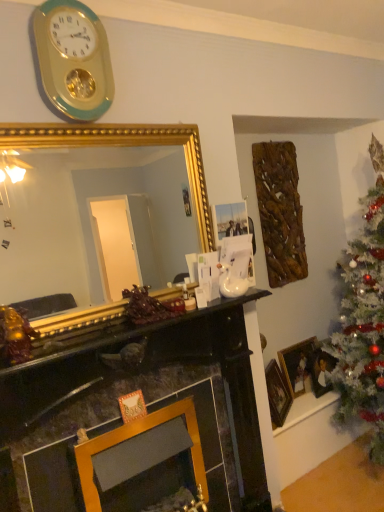
Where is `wooden picture frame at right, marked as the third picture frame in a front-to-back arrangement`? Image resolution: width=384 pixels, height=512 pixels. wooden picture frame at right, marked as the third picture frame in a front-to-back arrangement is located at coordinates (297, 365).

Describe the element at coordinates (297, 365) in the screenshot. Image resolution: width=384 pixels, height=512 pixels. I see `wooden picture frame at right, marked as the third picture frame in a front-to-back arrangement` at that location.

The height and width of the screenshot is (512, 384). What do you see at coordinates (90, 220) in the screenshot?
I see `gold/gilded mirror at center` at bounding box center [90, 220].

What do you see at coordinates (277, 394) in the screenshot?
I see `gold-framed picture at right, which appears as the 3th picture frame when viewed from the back` at bounding box center [277, 394].

The image size is (384, 512). What do you see at coordinates (363, 319) in the screenshot?
I see `white matte christmas tree at right` at bounding box center [363, 319].

Where is `wooden picture frame at lower right, which ranks as the 2th picture frame in back-to-front order`? The image size is (384, 512). wooden picture frame at lower right, which ranks as the 2th picture frame in back-to-front order is located at coordinates (320, 370).

Considering the sizes of objects gold-framed picture at right, the first picture frame from the front, and gold/gilded mirror at center in the image provided, who is smaller, gold-framed picture at right, the first picture frame from the front, or gold/gilded mirror at center?

gold-framed picture at right, the first picture frame from the front, is smaller.

From a real-world perspective, does gold-framed picture at right, which appears as the 3th picture frame when viewed from the back, sit lower than gold/gilded mirror at center?

Yes.

Could you tell me if gold-framed picture at right, which appears as the 3th picture frame when viewed from the back, is facing gold/gilded mirror at center?

No, gold-framed picture at right, which appears as the 3th picture frame when viewed from the back, is not turned towards gold/gilded mirror at center.

Considering the sizes of gold-framed picture at right, which appears as the 3th picture frame when viewed from the back, and gold/gilded mirror at center in the image, is gold-framed picture at right, which appears as the 3th picture frame when viewed from the back, taller or shorter than gold/gilded mirror at center?

Clearly, gold-framed picture at right, which appears as the 3th picture frame when viewed from the back, is shorter compared to gold/gilded mirror at center.

Is gold/green plastic wall clock at upper left facing towards wooden picture frame at right, marked as the third picture frame in a front-to-back arrangement?

No, gold/green plastic wall clock at upper left is not facing towards wooden picture frame at right, marked as the third picture frame in a front-to-back arrangement.

From the image's perspective, is gold/green plastic wall clock at upper left over wooden picture frame at right, the first picture frame viewed from the back?

Indeed, from the image's perspective, gold/green plastic wall clock at upper left is shown above wooden picture frame at right, the first picture frame viewed from the back.

Is gold/green plastic wall clock at upper left shorter than wooden picture frame at right, the first picture frame viewed from the back?

No.

Does point (106, 36) come farther from viewer compared to point (284, 364)?

That is False.

Is gold/gilded mirror at center in front of or behind wooden picture frame at lower right, which ranks as the 2th picture frame in back-to-front order, in the image?

Visually, gold/gilded mirror at center is located in front of wooden picture frame at lower right, which ranks as the 2th picture frame in back-to-front order.

In terms of height, does gold/gilded mirror at center look taller or shorter compared to wooden picture frame at lower right, which appears as the second picture frame when viewed from the front?

Clearly, gold/gilded mirror at center is taller compared to wooden picture frame at lower right, which appears as the second picture frame when viewed from the front.

Based on the photo, from the image's perspective, who appears lower, gold/gilded mirror at center or wooden picture frame at lower right, which ranks as the 2th picture frame in back-to-front order?

wooden picture frame at lower right, which ranks as the 2th picture frame in back-to-front order, is shown below in the image.

Can you confirm if gold/gilded mirror at center is thinner than wooden picture frame at lower right, which ranks as the 2th picture frame in back-to-front order?

Incorrect, the width of gold/gilded mirror at center is not less than that of wooden picture frame at lower right, which ranks as the 2th picture frame in back-to-front order.

Is wooden picture frame at lower right, which ranks as the 2th picture frame in back-to-front order, completely or partially inside wooden picture frame at right, marked as the third picture frame in a front-to-back arrangement?

That's incorrect, wooden picture frame at lower right, which ranks as the 2th picture frame in back-to-front order, is not inside wooden picture frame at right, marked as the third picture frame in a front-to-back arrangement.

Is wooden picture frame at right, marked as the third picture frame in a front-to-back arrangement, closer to camera compared to wooden picture frame at lower right, which appears as the second picture frame when viewed from the front?

No.

How different are the orientations of wooden picture frame at right, the first picture frame viewed from the back, and wooden picture frame at lower right, which ranks as the 2th picture frame in back-to-front order, in degrees?

The facing directions of wooden picture frame at right, the first picture frame viewed from the back, and wooden picture frame at lower right, which ranks as the 2th picture frame in back-to-front order, are 0.045 degrees apart.

Visually, is wooden picture frame at right, the first picture frame viewed from the back, positioned to the left or to the right of wooden picture frame at lower right, which appears as the second picture frame when viewed from the front?

Based on their positions, wooden picture frame at right, the first picture frame viewed from the back, is located to the left of wooden picture frame at lower right, which appears as the second picture frame when viewed from the front.

How many degrees apart are the facing directions of wooden picture frame at right, the first picture frame viewed from the back, and white matte christmas tree at right?

There is a 89.4-degree angle between the facing directions of wooden picture frame at right, the first picture frame viewed from the back, and white matte christmas tree at right.

Can you confirm if wooden picture frame at right, the first picture frame viewed from the back, is smaller than white matte christmas tree at right?

Indeed, wooden picture frame at right, the first picture frame viewed from the back, has a smaller size compared to white matte christmas tree at right.

From a real-world perspective, is wooden picture frame at right, marked as the third picture frame in a front-to-back arrangement, above or below white matte christmas tree at right?

From a real-world perspective, wooden picture frame at right, marked as the third picture frame in a front-to-back arrangement, is physically below white matte christmas tree at right.

Is wooden picture frame at right, marked as the third picture frame in a front-to-back arrangement, beside white matte christmas tree at right?

No, wooden picture frame at right, marked as the third picture frame in a front-to-back arrangement, is not with white matte christmas tree at right.

What's the angular difference between gold/gilded mirror at center and gold/green plastic wall clock at upper left's facing directions?

The facing directions of gold/gilded mirror at center and gold/green plastic wall clock at upper left are 0.00591 degrees apart.

From the picture: Is gold/gilded mirror at center thinner than gold/green plastic wall clock at upper left?

Yes.

Can you confirm if gold/gilded mirror at center is bigger than gold/green plastic wall clock at upper left?

Yes.

Is gold/gilded mirror at center closer to camera compared to gold/green plastic wall clock at upper left?

Yes.

Consider the image. Does gold/gilded mirror at center touch white matte christmas tree at right?

No.

You are a GUI agent. You are given a task and a screenshot of the screen. Output one action in this format:
    pyautogui.click(x=<x>, y=<y>)
    Task: Click on the mirror positioned vertically above the white matte christmas tree at right (from a real-world perspective)
    The width and height of the screenshot is (384, 512).
    Given the screenshot: What is the action you would take?
    pyautogui.click(x=90, y=220)

Considering the sizes of objects gold/gilded mirror at center and white matte christmas tree at right in the image provided, who is wider, gold/gilded mirror at center or white matte christmas tree at right?

white matte christmas tree at right.

Identify the location of mirror above the gold-framed picture at right, which appears as the 3th picture frame when viewed from the back (from the image's perspective). This screenshot has width=384, height=512. (90, 220).

From the image's perspective, count 2nd picture frames downward from the gold/green plastic wall clock at upper left and point to it. Please provide its 2D coordinates.

[(297, 365)]

From the image, which object appears to be nearer to gold/gilded mirror at center, white matte christmas tree at right or gold-framed picture at right, the first picture frame from the front?

Based on the image, white matte christmas tree at right appears to be nearer to gold/gilded mirror at center.

Looking at the image, which one is located closer to wooden picture frame at right, the first picture frame viewed from the back, white matte christmas tree at right or gold-framed picture at right, which appears as the 3th picture frame when viewed from the back?

Based on the image, gold-framed picture at right, which appears as the 3th picture frame when viewed from the back, appears to be nearer to wooden picture frame at right, the first picture frame viewed from the back.

Looking at the image, which one is located closer to wooden picture frame at right, marked as the third picture frame in a front-to-back arrangement, wooden picture frame at lower right, which ranks as the 2th picture frame in back-to-front order, or gold/gilded mirror at center?

wooden picture frame at lower right, which ranks as the 2th picture frame in back-to-front order, is closer to wooden picture frame at right, marked as the third picture frame in a front-to-back arrangement.

Looking at the image, which one is located further to wooden picture frame at lower right, which ranks as the 2th picture frame in back-to-front order, wooden picture frame at right, the first picture frame viewed from the back, or gold/green plastic wall clock at upper left?

gold/green plastic wall clock at upper left is positioned further to the anchor wooden picture frame at lower right, which ranks as the 2th picture frame in back-to-front order.

Which object lies nearer to the anchor point wooden picture frame at lower right, which appears as the second picture frame when viewed from the front, white matte christmas tree at right or gold/gilded mirror at center?

white matte christmas tree at right.

From the image, which object appears to be farther from gold-framed picture at right, which appears as the 3th picture frame when viewed from the back, white matte christmas tree at right or wooden picture frame at right, marked as the third picture frame in a front-to-back arrangement?

white matte christmas tree at right lies further to gold-framed picture at right, which appears as the 3th picture frame when viewed from the back, than the other object.

Which object lies further to the anchor point wooden picture frame at lower right, which ranks as the 2th picture frame in back-to-front order, wooden picture frame at right, marked as the third picture frame in a front-to-back arrangement, or white matte christmas tree at right?

white matte christmas tree at right.

Estimate the real-world distances between objects in this image. Which object is further from wooden picture frame at lower right, which appears as the second picture frame when viewed from the front, gold/gilded mirror at center or gold-framed picture at right, the first picture frame from the front?

gold/gilded mirror at center is further to wooden picture frame at lower right, which appears as the second picture frame when viewed from the front.

The width and height of the screenshot is (384, 512). I want to click on picture frame located between white matte christmas tree at right and wooden picture frame at lower right, which appears as the second picture frame when viewed from the front, in the depth direction, so [277, 394].

Identify the location of mirror between gold/green plastic wall clock at upper left and white matte christmas tree at right in the horizontal direction. The height and width of the screenshot is (512, 384). (90, 220).

This screenshot has width=384, height=512. I want to click on picture frame between gold-framed picture at right, the first picture frame from the front, and wooden picture frame at right, the first picture frame viewed from the back, in the front-back direction, so click(320, 370).

Where is `mirror between gold/green plastic wall clock at upper left and wooden picture frame at right, the first picture frame viewed from the back, from top to bottom`? This screenshot has height=512, width=384. mirror between gold/green plastic wall clock at upper left and wooden picture frame at right, the first picture frame viewed from the back, from top to bottom is located at coordinates (90, 220).